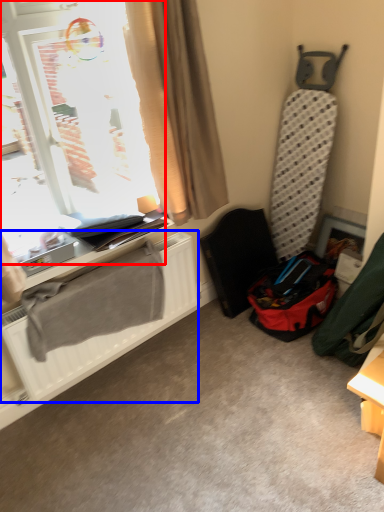
Question: Which object appears farthest to the camera in this image, window (highlighted by a red box) or radiator (highlighted by a blue box)?

Choices:
 (A) window
 (B) radiator

Answer: (B)